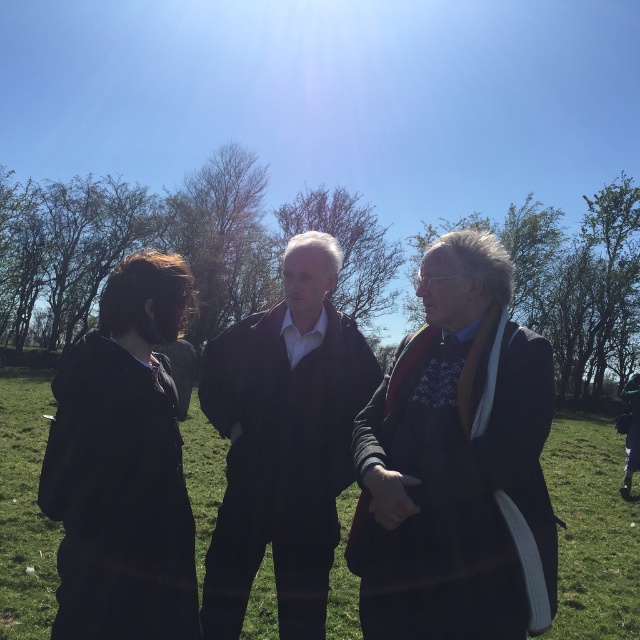
Question: Which object is the closest to the dark gray suit at center?

Choices:
 (A) matte black jacket at center
 (B) green grass at center
 (C) black fabric jacket at left

Answer: (A)

Question: Is matte black jacket at center in front of green grass at center?

Choices:
 (A) no
 (B) yes

Answer: (B)

Question: Which point is farther to the camera?

Choices:
 (A) matte black jacket at center
 (B) dark gray suit at center
 (C) green grass at center

Answer: (C)

Question: Which point is closer to the camera?

Choices:
 (A) matte black jacket at center
 (B) dark gray suit at center
 (C) green grass at center
 (D) black fabric jacket at left

Answer: (B)

Question: Does black fabric jacket at left have a greater width compared to green grass at center?

Choices:
 (A) yes
 (B) no

Answer: (B)

Question: Observing the image, what is the correct spatial positioning of dark gray suit at center in reference to matte black jacket at center?

Choices:
 (A) right
 (B) left

Answer: (A)